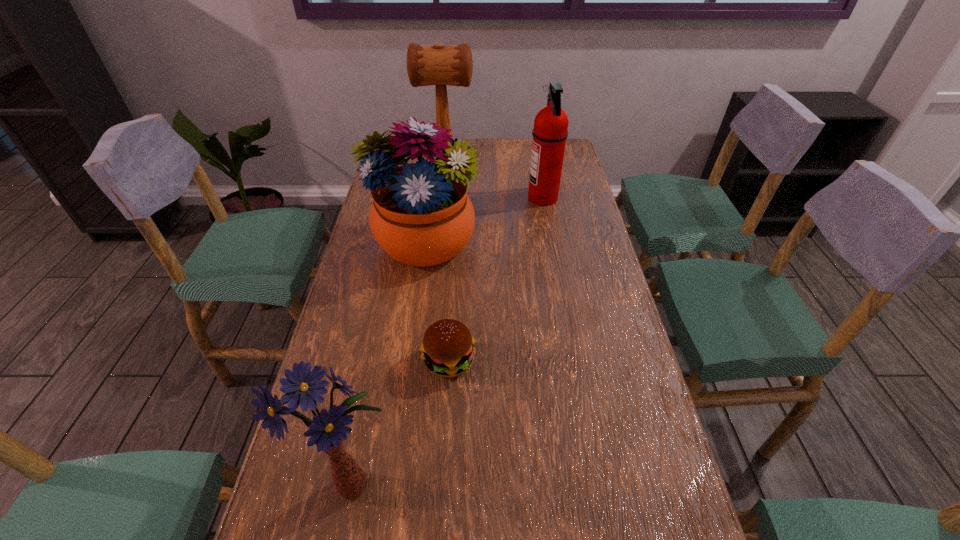
Image resolution: width=960 pixels, height=540 pixels. Identify the location of vacant region located on the side of the rightmost object near the handle. (452, 198).

The height and width of the screenshot is (540, 960). I want to click on free spot located on the right of the farther flower arrangement, so click(x=519, y=244).

Where is `vacant space located on the back of the nearest object`? This screenshot has height=540, width=960. vacant space located on the back of the nearest object is located at coordinates (379, 368).

You are a GUI agent. You are given a task and a screenshot of the screen. Output one action in this format:
    pyautogui.click(x=<x>, y=<y>)
    Task: Click on the blank space located on the back of the fourth farthest object
    The image size is (960, 540).
    Given the screenshot: What is the action you would take?
    pyautogui.click(x=456, y=248)

Find the location of a particular element. object present at the far edge is located at coordinates (438, 65).

Locate an element on the screen. The image size is (960, 540). mallet that is at the left edge is located at coordinates (438, 65).

You are a GUI agent. You are given a task and a screenshot of the screen. Output one action in this format:
    pyautogui.click(x=<x>, y=<y>)
    Task: Click on the object that is at the right edge
    
    Given the screenshot: What is the action you would take?
    pyautogui.click(x=550, y=131)

Image resolution: width=960 pixels, height=540 pixels. Identify the location of object that is at the far left corner. (438, 65).

The image size is (960, 540). Identify the location of vacant space at the far edge. (477, 143).

Locate an element on the screen. The image size is (960, 540). vacant space at the left edge is located at coordinates (354, 308).